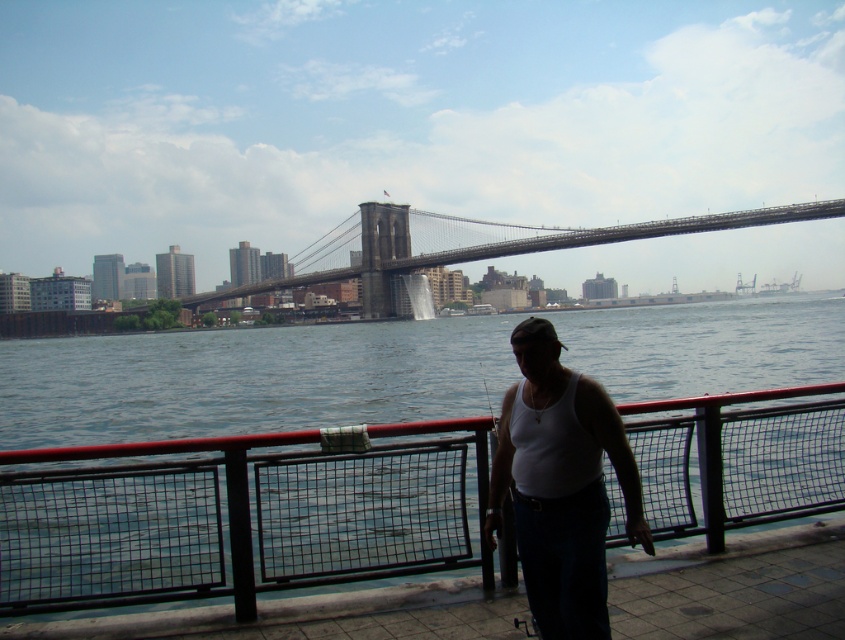
Can you confirm if black metal fence at lower center is thinner than white cotton tank top at center?

Correct, black metal fence at lower center's width is less than white cotton tank top at center's.

The width and height of the screenshot is (845, 640). What are the coordinates of `black metal fence at lower center` in the screenshot? It's located at pyautogui.click(x=236, y=516).

What do you see at coordinates (236, 516) in the screenshot? I see `black metal fence at lower center` at bounding box center [236, 516].

Identify the location of black metal fence at lower center. (236, 516).

The image size is (845, 640). Describe the element at coordinates (560, 484) in the screenshot. I see `white cotton tank top at center` at that location.

At what (x,y) coordinates should I click in order to perform the action: click on white cotton tank top at center. Please return your answer as a coordinate pair (x, y). The height and width of the screenshot is (640, 845). Looking at the image, I should click on (560, 484).

Is point (614, 416) positioned before point (611, 230)?

That is True.

The height and width of the screenshot is (640, 845). In order to click on white cotton tank top at center in this screenshot , I will do `click(560, 484)`.

Is black metal fence at lower center above metallic gray bridge at center?

No.

Does black metal fence at lower center have a smaller size compared to metallic gray bridge at center?

Yes.

Identify the location of black metal fence at lower center. This screenshot has height=640, width=845. (236, 516).